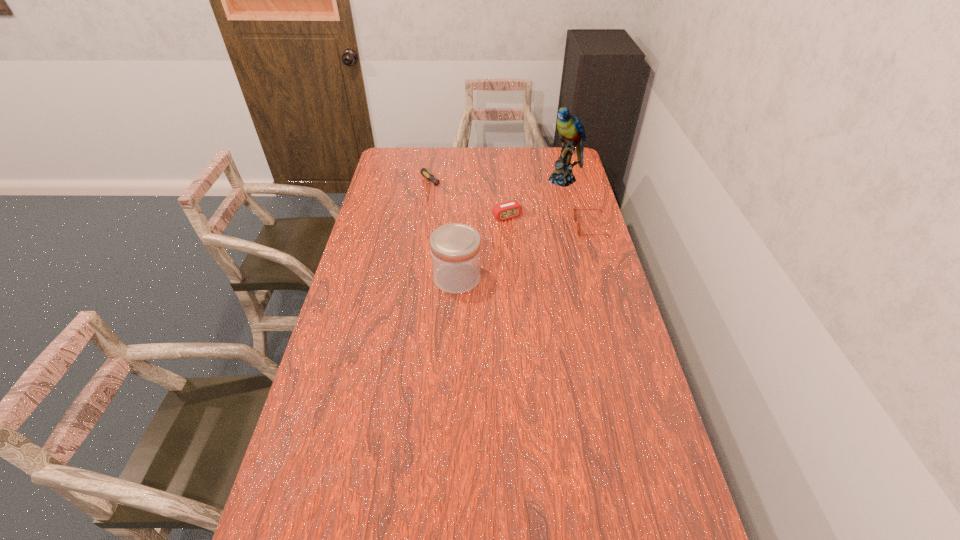
The width and height of the screenshot is (960, 540). In order to click on free space on the desktop that is between the fourth shortest object and the fourth tallest object and is positioned insert the shortest object into a screw head in this screenshot , I will do `click(516, 255)`.

This screenshot has height=540, width=960. What are the coordinates of `vacant spot on the desktop that is between the second tallest object and the sunglasses and is positioned on the front-facing side of the third object from left to right` in the screenshot? It's located at (533, 249).

You are a GUI agent. You are given a task and a screenshot of the screen. Output one action in this format:
    pyautogui.click(x=<x>, y=<y>)
    Task: Click on the vacant spot on the desktop that is between the nearest object and the fourth tallest object and is positioned on the face of the parrot
    
    Given the screenshot: What is the action you would take?
    pyautogui.click(x=514, y=256)